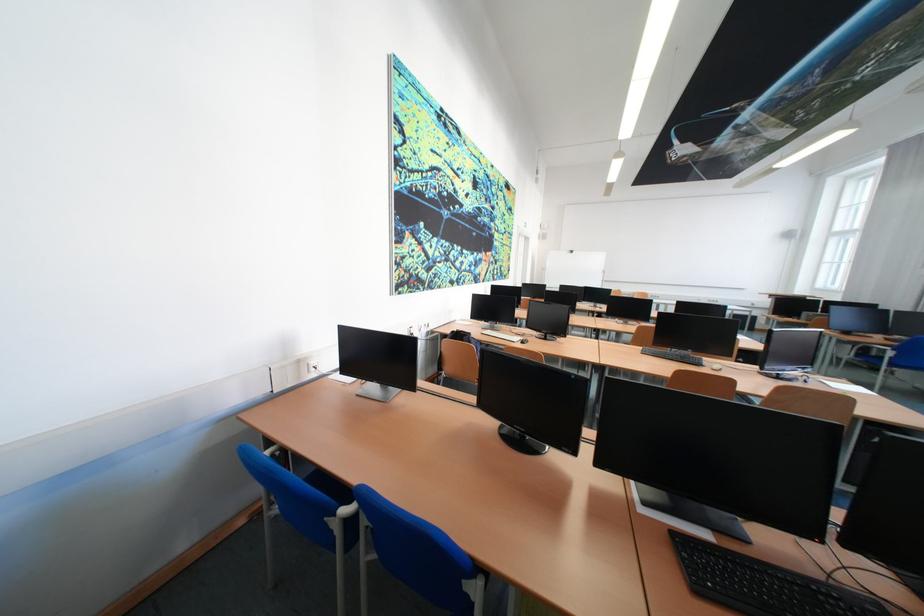
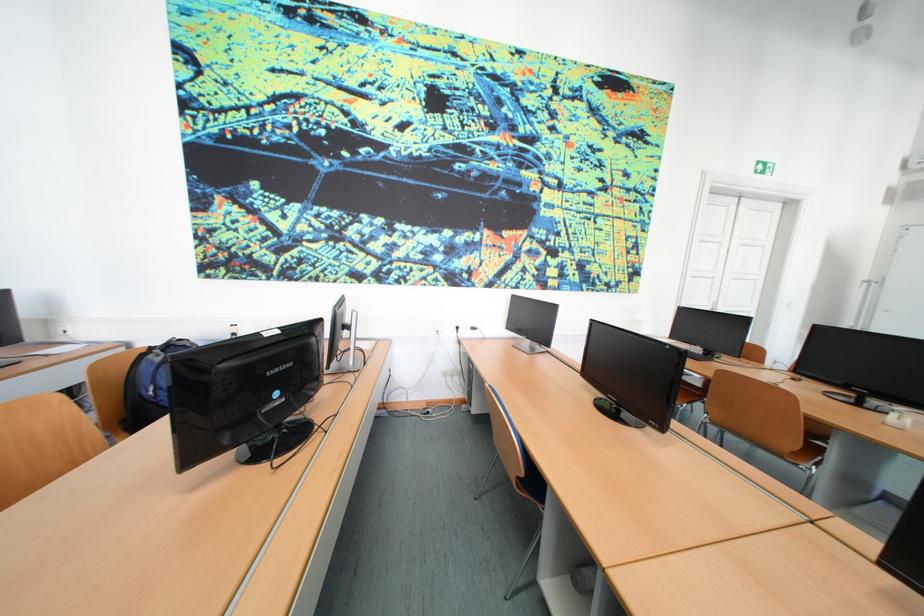
Question: I am providing you with two images of the same scene from different viewpoints. Which of the following objects are not visible in image2?

Choices:
 (A) black computer mouse
 (B) red shopping bag
 (C) brown chair sitting surface
 (D) wall power outlet

Answer: (A)